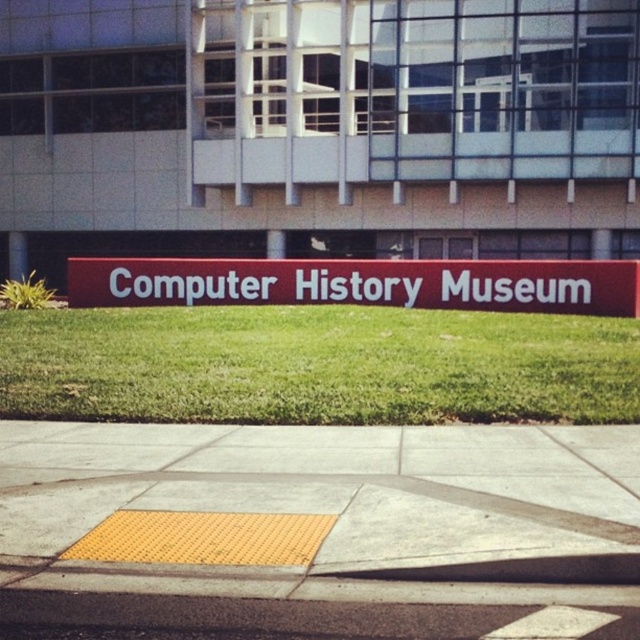
In the scene shown: Between yellow textured pavement at center and green grass at center, which one appears on the left side from the viewer's perspective?

green grass at center is more to the left.

Can you confirm if yellow textured pavement at center is positioned above green grass at center?

Incorrect, yellow textured pavement at center is not positioned above green grass at center.

Is point (564, 529) positioned after point (416, 310)?

No.

Identify the location of yellow textured pavement at center. (332, 529).

Does green grass at center have a lesser height compared to red matte sign at center?

Yes.

Does green grass at center come behind red matte sign at center?

No, it is not.

Between point (104, 372) and point (547, 269), which one is positioned behind?

The point (547, 269) is more distant.

Find the location of a particular element. The height and width of the screenshot is (640, 640). green grass at center is located at coordinates (316, 365).

Which is below, yellow textured pavement at center or red matte sign at center?

yellow textured pavement at center is lower down.

Does yellow textured pavement at center appear over red matte sign at center?

No.

Is point (28, 577) in front of point (460, 268)?

Yes.

At what (x,y) coordinates should I click in order to perform the action: click on yellow textured pavement at center. Please return your answer as a coordinate pair (x, y). The height and width of the screenshot is (640, 640). Looking at the image, I should click on (332, 529).